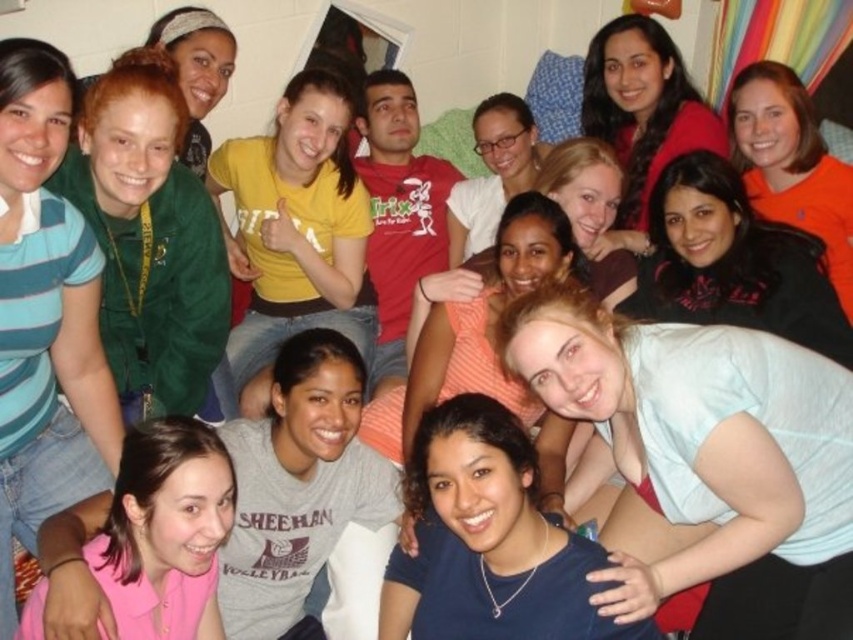
Does blue striped shirt at left appear under green fabric jacket at upper left?

Yes.

Does blue striped shirt at left have a larger size compared to green fabric jacket at upper left?

No, blue striped shirt at left is not bigger than green fabric jacket at upper left.

Is point (49, 481) positioned after point (206, 264)?

No, (49, 481) is in front of (206, 264).

In order to click on blue striped shirt at left in this screenshot , I will do `click(45, 316)`.

Is point (717, 230) farther from viewer compared to point (486, 156)?

That is False.

The width and height of the screenshot is (853, 640). What do you see at coordinates (733, 262) in the screenshot?
I see `black matte jacket at upper right` at bounding box center [733, 262].

Which is in front, point (822, 268) or point (489, 195)?

Point (822, 268) is more forward.

You are a GUI agent. You are given a task and a screenshot of the screen. Output one action in this format:
    pyautogui.click(x=<x>, y=<y>)
    Task: Click on the black matte jacket at upper right
    
    Given the screenshot: What is the action you would take?
    pyautogui.click(x=733, y=262)

Can you confirm if blue striped shirt at left is taller than orange matte shirt at upper right?

Indeed, blue striped shirt at left has a greater height compared to orange matte shirt at upper right.

Who is more distant from viewer, [9,289] or [844,259]?

Positioned behind is point [844,259].

Between point (79, 364) and point (766, 189), which one is positioned in front?

Point (79, 364) is more forward.

This screenshot has width=853, height=640. I want to click on blue striped shirt at left, so click(45, 316).